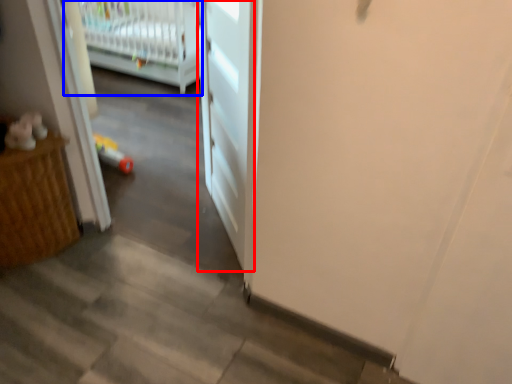
Question: Which object appears closest to the camera in this image, door (highlighted by a red box) or infant bed (highlighted by a blue box)?

Choices:
 (A) door
 (B) infant bed

Answer: (A)